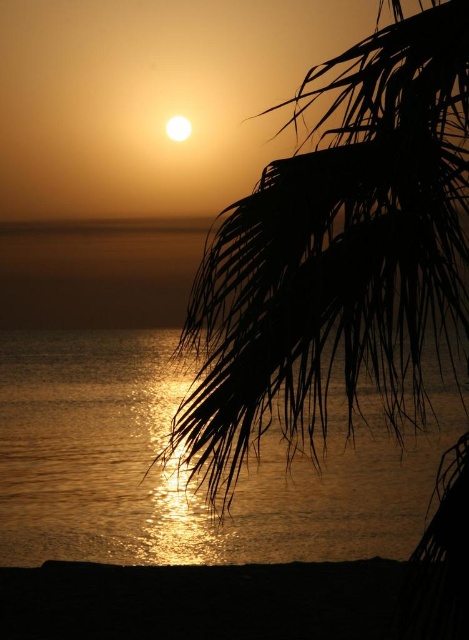
You are standing at the water edge in the sunset scene. There is a silhouette leafy branch at upper right. Can you reach it with a 3 meter long fishing rod?

The silhouette leafy branch at upper right is 2.79 meters away from viewer, so yes, you can reach it with a 3 meter long fishing rod since it is longer than the distance.

You are an artist trying to paint the sunset scene. You want to ensure the silhouette leafy branch at upper right and glistening water at center are proportionally accurate. Which object should you make larger in your painting?

The silhouette leafy branch at upper right should be made larger than the glistening water at center in the painting, as it is described as bigger in the scene.